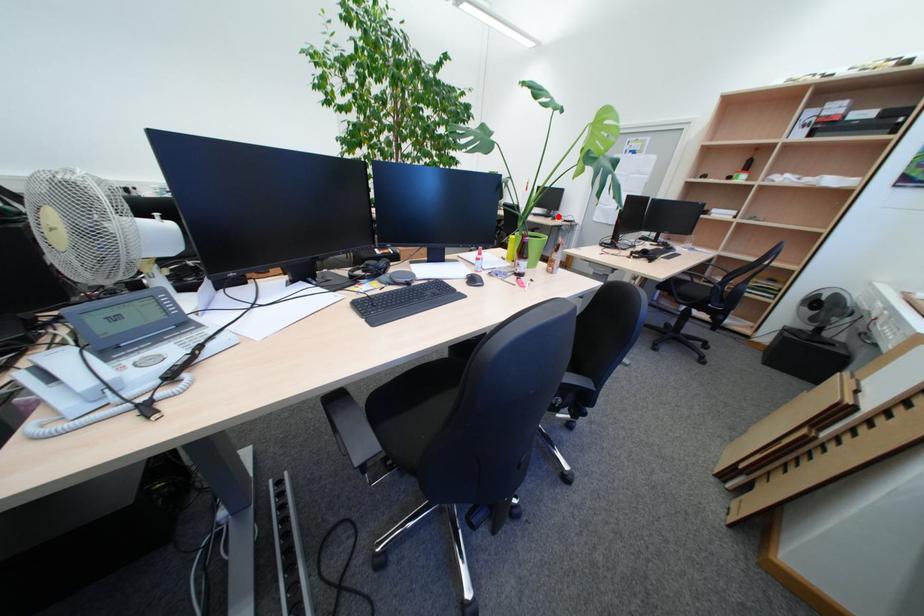
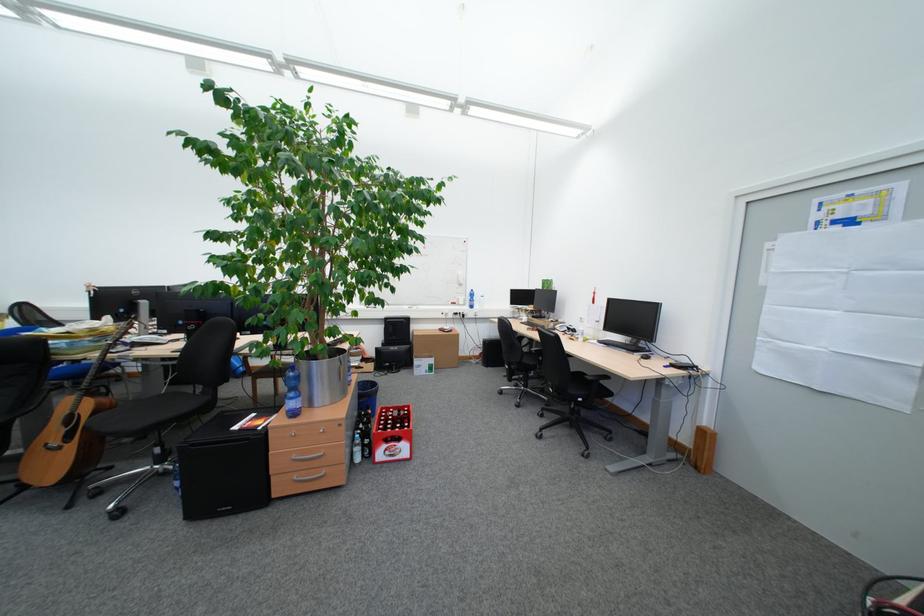
The point at the highlighted location is marked in the first image. Where is the corresponding point in the second image?

(642, 350)